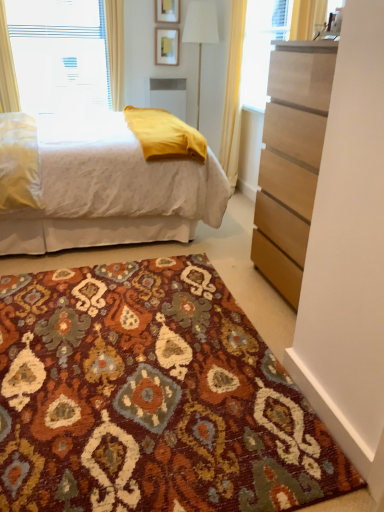
Locate an element on the screen. vacant position to the left of light brown wood chest of drawers at right is located at coordinates (235, 278).